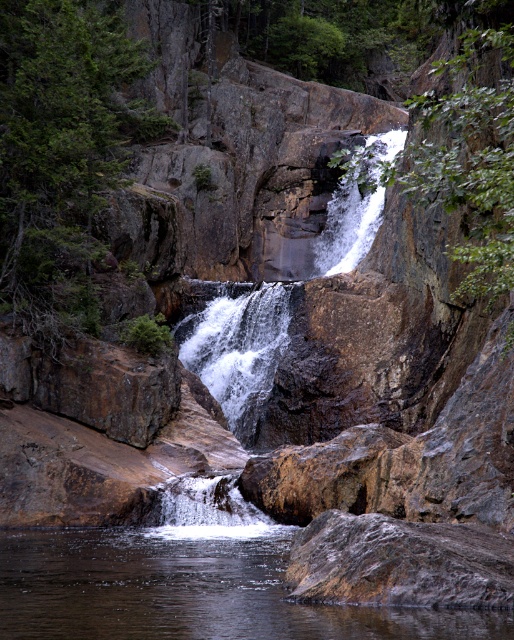
You are a hiker standing at the entrance of the trail and want to locate the rough stone waterfall at center. According to the coordinates provided, where should you look to find it?

The rough stone waterfall at center is located at coordinates point [238,349].

You are standing at the edge of the pool and want to reach the rough stone waterfall at center without getting wet. Can you step over the clear water at center to do so?

The clear water at center is closer to the viewer than the rough stone waterfall at center, so stepping over the clear water at center would bring you closer to the rough stone waterfall at center. However, since the water is in your path, you might get wet when attempting to step over it.

You are standing at the edge of the pool at the base of the waterfall. You want to throw a small pebble to hit both the rough stone waterfall at center and the white frothy water at center. Which one should you aim for first, the closer one or the farther one?

The rough stone waterfall at center is 5.44 feet away from the white frothy water at center. Since you are at the edge of the pool, the white frothy water at center is closer to you, so aim for it first.